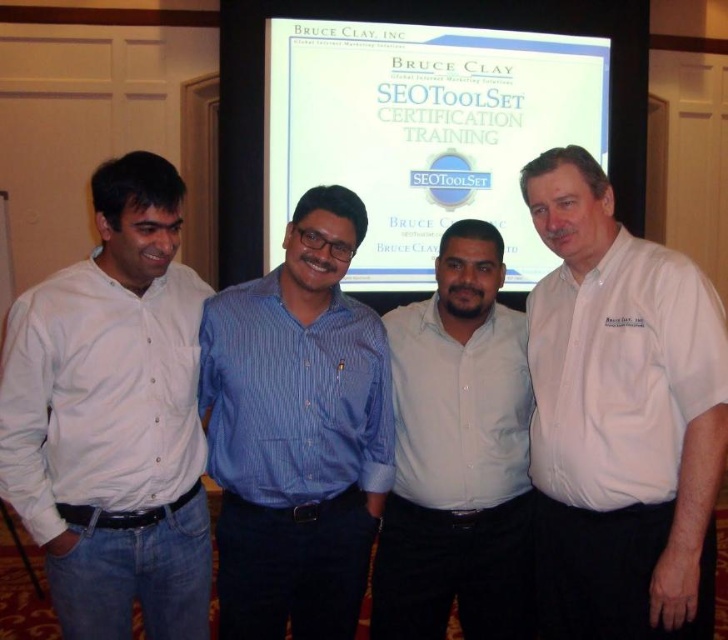
Is white cotton shirt at center to the left of white glossy projector screen at upper center from the viewer's perspective?

No, white cotton shirt at center is not to the left of white glossy projector screen at upper center.

Where is `white cotton shirt at center`? This screenshot has height=640, width=728. white cotton shirt at center is located at coordinates (620, 417).

At what (x,y) coordinates should I click in order to perform the action: click on white cotton shirt at center. Please return your answer as a coordinate pair (x, y). The image size is (728, 640). Looking at the image, I should click on (620, 417).

Which of these two, blue striped shirt at center or white shirt at center, stands shorter?

Standing shorter between the two is blue striped shirt at center.

Locate an element on the screen. blue striped shirt at center is located at coordinates (296, 432).

Is point (312, 516) in front of point (514, 417)?

Yes, point (312, 516) is closer to viewer.

Find the location of a particular element. blue striped shirt at center is located at coordinates (296, 432).

This screenshot has width=728, height=640. Describe the element at coordinates (423, 132) in the screenshot. I see `white glossy projector screen at upper center` at that location.

Locate an element on the screen. white glossy projector screen at upper center is located at coordinates (423, 132).

At what (x,y) coordinates should I click in order to perform the action: click on white glossy projector screen at upper center. Please return your answer as a coordinate pair (x, y). Looking at the image, I should click on (423, 132).